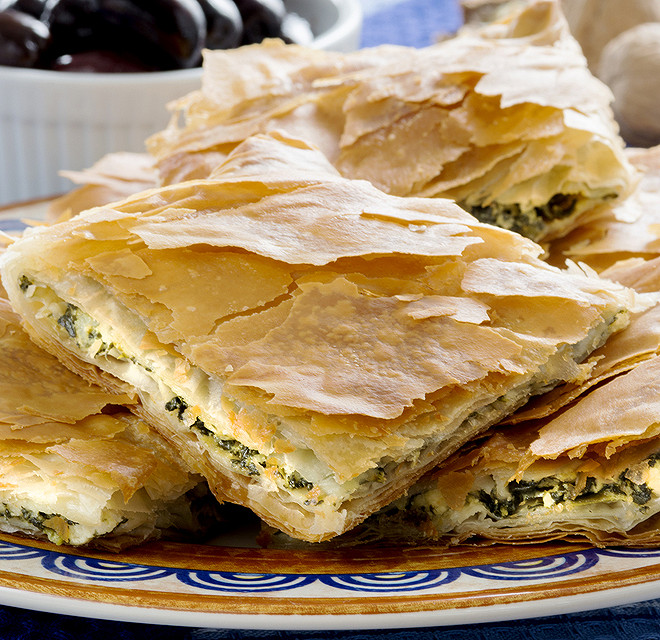
This screenshot has height=640, width=660. Find the location of `bare part of plate between food`. bare part of plate between food is located at coordinates (228, 534).